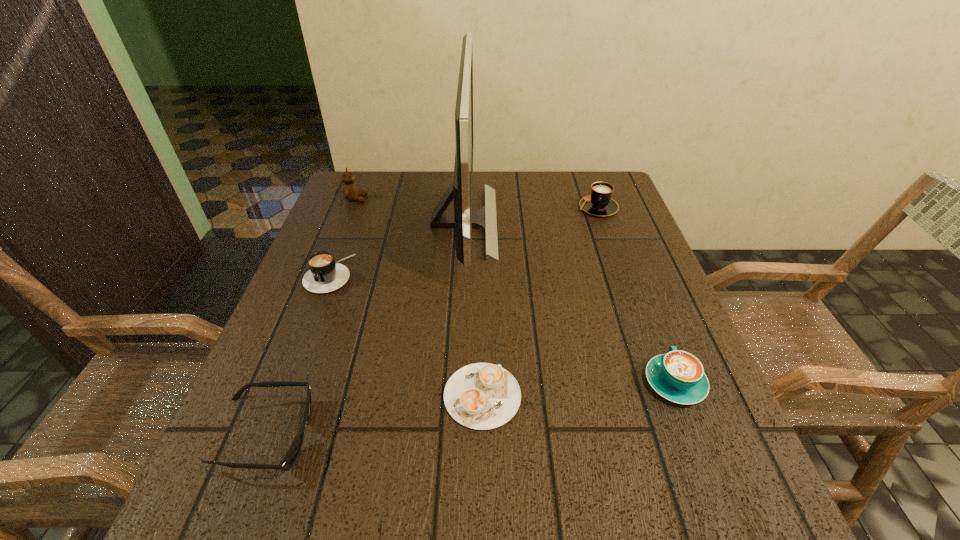
Identify the location of free location at the right edge of the desktop. (633, 382).

In the image, there is a desktop. At what (x,y) coordinates should I click in order to perform the action: click on blank space at the far left corner. Please return your answer as a coordinate pair (x, y). This screenshot has height=540, width=960. Looking at the image, I should click on (355, 210).

This screenshot has height=540, width=960. In order to click on free space at the far right corner of the desktop in this screenshot , I will do `click(611, 175)`.

The image size is (960, 540). I want to click on free spot between the teddy bear and the farthest cappuccino, so click(x=477, y=203).

The height and width of the screenshot is (540, 960). I want to click on vacant area that lies between the second tallest object and the third tallest cappuccino, so click(x=516, y=291).

Where is `vacant area that lies between the shortest cappuccino and the farthest cappuccino`? vacant area that lies between the shortest cappuccino and the farthest cappuccino is located at coordinates (540, 302).

The width and height of the screenshot is (960, 540). In order to click on free space that is in between the shortest object and the farthest cappuccino in this screenshot , I will do `click(540, 302)`.

At what (x,y) coordinates should I click in order to perform the action: click on vacant space that is in between the farthest cappuccino and the tallest object. Please return your answer as a coordinate pair (x, y). The image size is (960, 540). Looking at the image, I should click on (531, 215).

At what (x,y) coordinates should I click in order to perform the action: click on free space between the third cappuccino from right to left and the sunglasses. Please return your answer as a coordinate pair (x, y). The image size is (960, 540). Looking at the image, I should click on (375, 416).

This screenshot has width=960, height=540. Find the location of `empty location between the third tallest cappuccino and the farthest cappuccino`. empty location between the third tallest cappuccino and the farthest cappuccino is located at coordinates (636, 295).